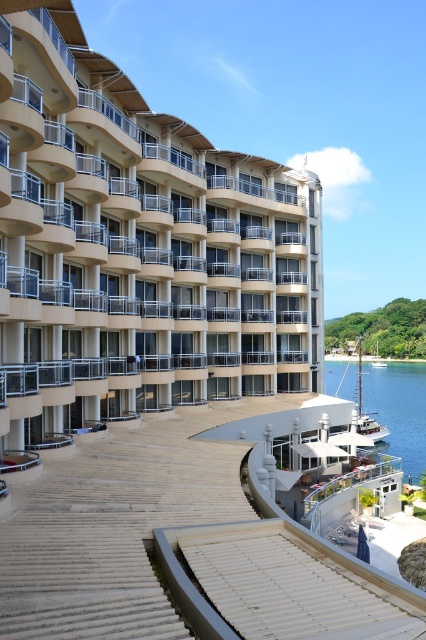
Question: Is beige concrete building at center above white wooden sailboat at lower right?

Choices:
 (A) no
 (B) yes

Answer: (B)

Question: Among these objects, which one is farthest from the camera?

Choices:
 (A) white wooden sailboat at lower right
 (B) beige concrete building at center
 (C) clear blue water at lower right

Answer: (C)

Question: Considering the relative positions of clear blue water at lower right and white wooden sailboat at lower right in the image provided, where is clear blue water at lower right located with respect to white wooden sailboat at lower right?

Choices:
 (A) below
 (B) above

Answer: (A)

Question: Which point is closer to the camera?

Choices:
 (A) beige concrete building at center
 (B) white wooden sailboat at lower right

Answer: (A)

Question: Can you confirm if beige concrete building at center is positioned to the left of white wooden sailboat at lower right?

Choices:
 (A) yes
 (B) no

Answer: (A)

Question: Which point appears closest to the camera in this image?

Choices:
 (A) (342, 392)
 (B) (190, 316)

Answer: (B)